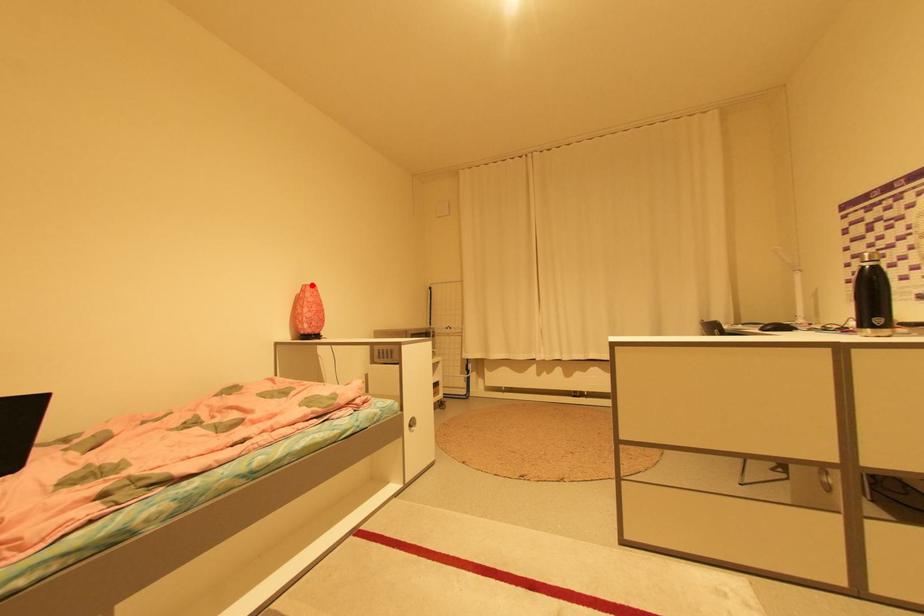
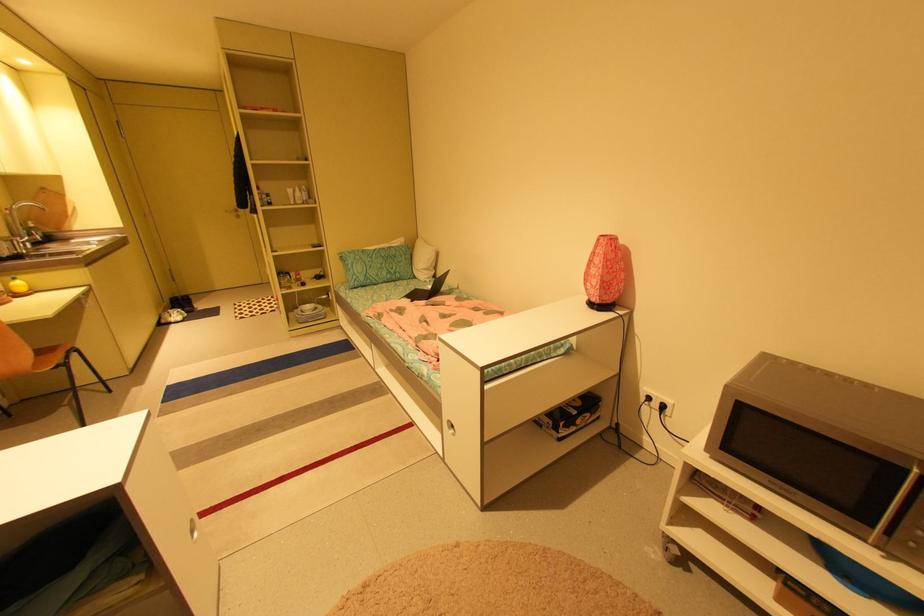
In the second image, find the point that corresponds to the highlighted location in the first image.

(608, 236)